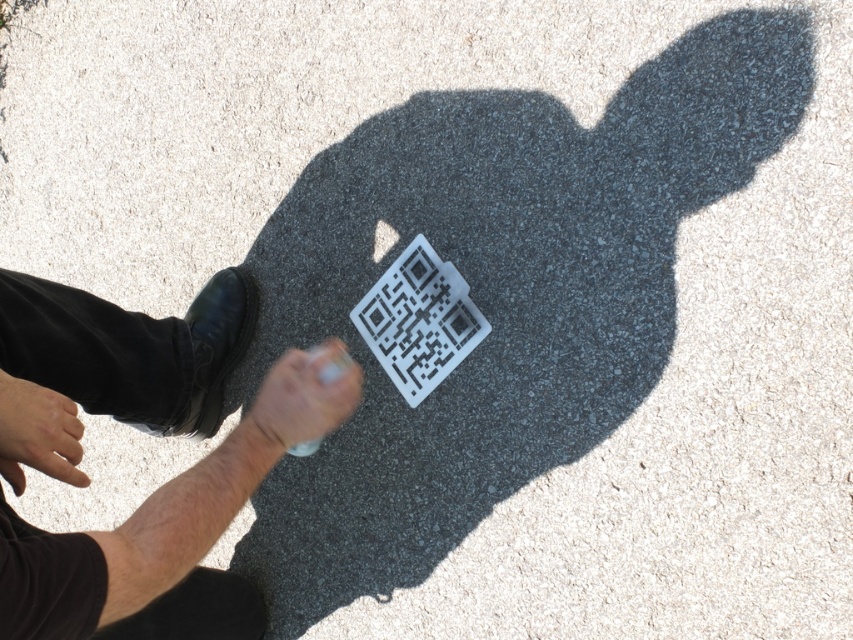
You are a delivery robot that needs to pass through a narrow pathway between the black leather shoe at lower left and the smooth skin hand at lower left. The robot is 0.5 meters wide. Can you fit through the pathway?

The black leather shoe at lower left is wider than the smooth skin hand at lower left. However, the exact width of the pathway between them isn not specified in the provided information. Without knowing the distance between the two objects, it is impossible to determine if the robot can fit through the pathway.

You are a delivery robot trying to scan a QR code. You see a transparent plastic qr code at center and a smooth skin hand at lower left. Which object is taller?

The transparent plastic qr code at center is taller than the smooth skin hand at lower left.